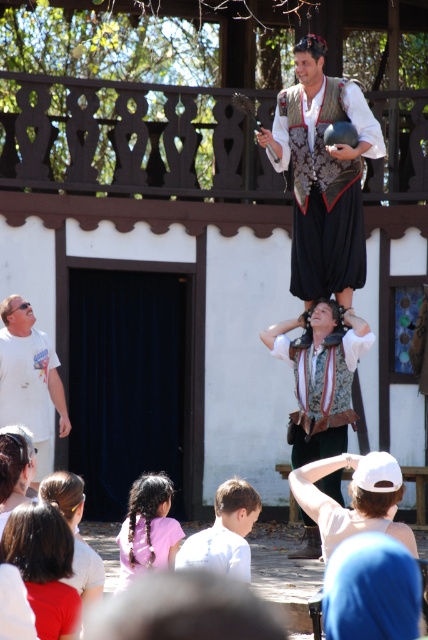
You are an event organizer planning to set up a photo booth near the blue fabric at lower right and the matte brown vest at center. Which object should you place the booth closer to if you want to ensure it doesn

The blue fabric at lower right occupies less space than the matte brown vest at center, so placing the booth closer to the blue fabric at lower right would require less space and be more practical.